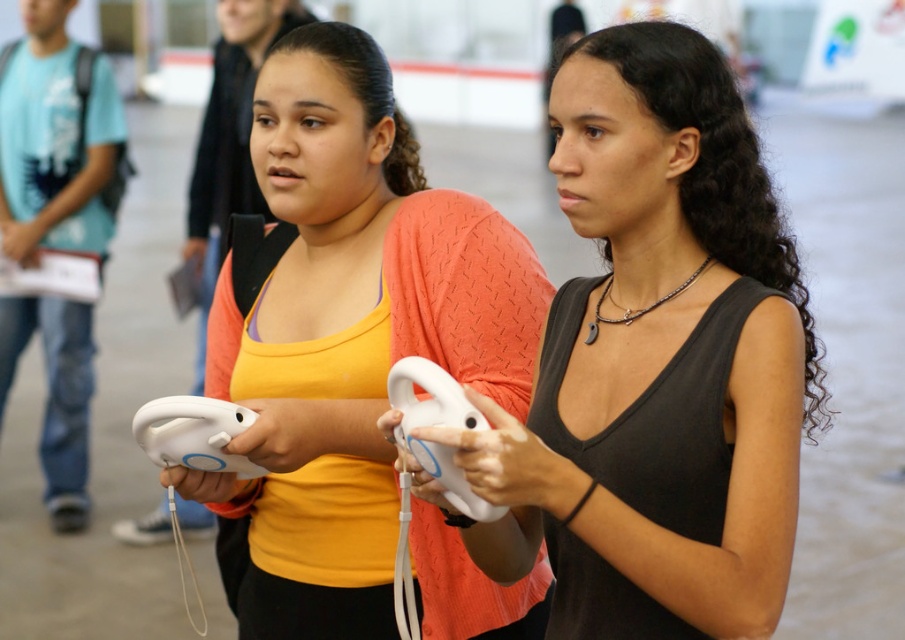
Question: Can you confirm if white matte wii remote at center is positioned to the right of white matte wii controller at center?

Choices:
 (A) yes
 (B) no

Answer: (A)

Question: Can you confirm if black matte tank top at center is positioned below matte white controller at center?

Choices:
 (A) yes
 (B) no

Answer: (A)

Question: Can you confirm if black matte tank top at center is wider than white matte wii remote at center?

Choices:
 (A) no
 (B) yes

Answer: (B)

Question: Which object appears closest to the camera in this image?

Choices:
 (A) white matte wii remote at center
 (B) white matte wii controller at center
 (C) black matte tank top at center
 (D) matte white controller at center

Answer: (C)

Question: Considering the real-world distances, which object is closest to the white matte wii controller at center?

Choices:
 (A) black matte tank top at center
 (B) matte white controller at center

Answer: (B)

Question: Which of the following is the closest to the observer?

Choices:
 (A) (427, 408)
 (B) (589, 106)
 (C) (137, 419)

Answer: (A)